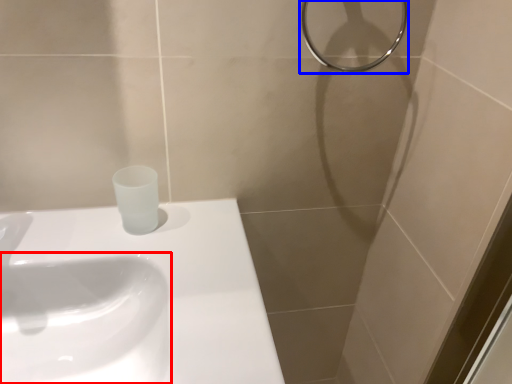
Question: Which of the following is the farthest to the observer, sink (highlighted by a red box) or shower (highlighted by a blue box)?

Choices:
 (A) sink
 (B) shower

Answer: (B)